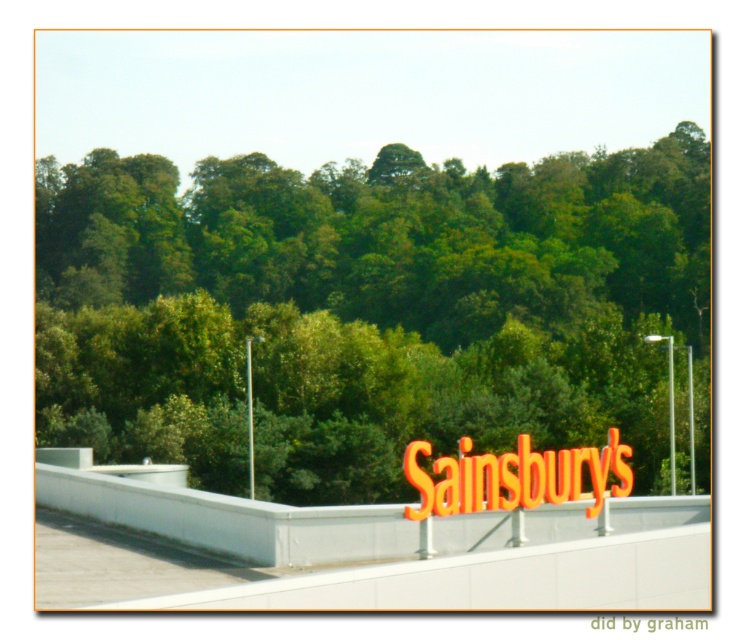
Where is the green leafy tree at upper center located in the image?

The green leafy tree at upper center is located at point coordinates of approximately 0.487 on the x axis and 0.499 on the y axis.

What is the object located at the coordinates point (515,477) in the scene?

The object located at point (515,477) is the orange plastic sign at center.